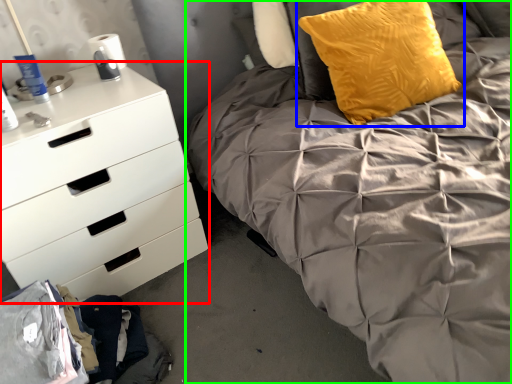
Question: Which object is positioned closest to chest of drawers (highlighted by a red box)? Select from pillow (highlighted by a blue box) and bed (highlighted by a green box).

Choices:
 (A) pillow
 (B) bed

Answer: (B)